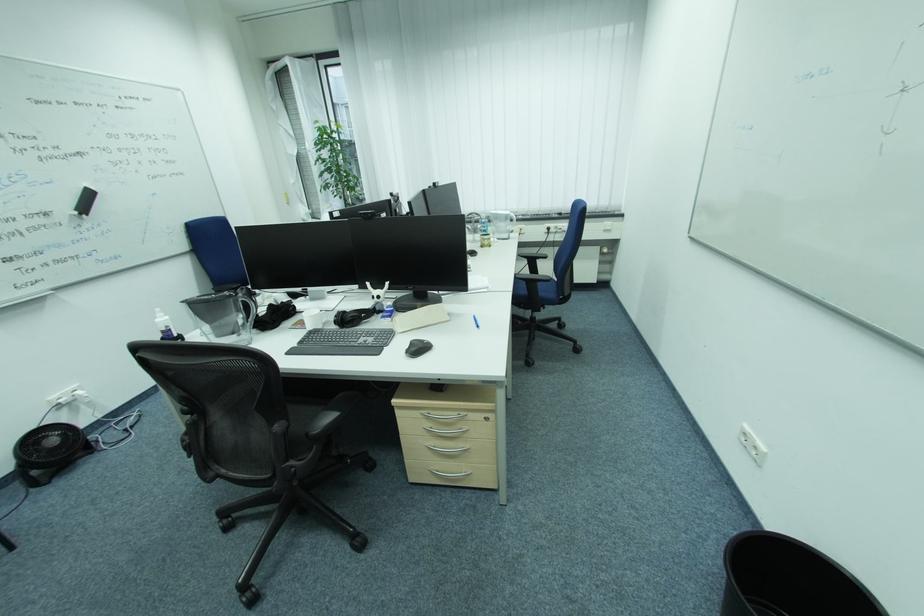
What do you see at coordinates (315, 424) in the screenshot? This screenshot has height=616, width=924. I see `a black chair armrest` at bounding box center [315, 424].